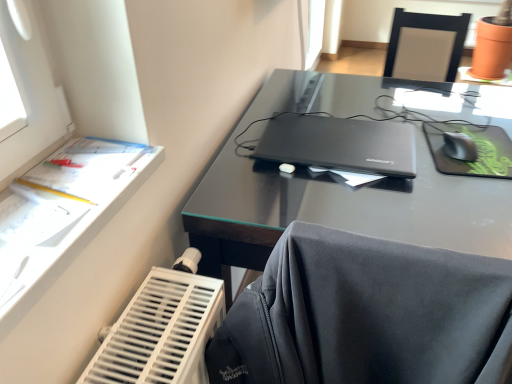
Describe the element at coordinates (342, 186) in the screenshot. I see `glossy black desk at center` at that location.

You are a GUI agent. You are given a task and a screenshot of the screen. Output one action in this format:
    pyautogui.click(x=<x>, y=<y>)
    Task: Click on the black matte mouse pad at right
    The height and width of the screenshot is (384, 512).
    Given the screenshot: What is the action you would take?
    pyautogui.click(x=476, y=147)

Where is `glossy black desk at center`? This screenshot has width=512, height=384. glossy black desk at center is located at coordinates (342, 186).

Considering the sizes of black matte mouse pad at right and white paper at left in the image, is black matte mouse pad at right wider or thinner than white paper at left?

black matte mouse pad at right is wider than white paper at left.

In terms of height, does black matte mouse pad at right look taller or shorter compared to white paper at left?

Clearly, black matte mouse pad at right is shorter compared to white paper at left.

Locate an element on the screen. tablet computer that is above the white paper at left (from the image's perspective) is located at coordinates (476, 147).

Which point is more forward, (451, 128) or (105, 215)?

The point (105, 215) is more forward.

In the image, is white paper at left positioned in front of or behind glossy black desk at center?

white paper at left is positioned closer to the viewer than glossy black desk at center.

Does white paper at left have a lesser width compared to glossy black desk at center?

Correct, the width of white paper at left is less than that of glossy black desk at center.

Considering the relative sizes of white paper at left and glossy black desk at center in the image provided, is white paper at left shorter than glossy black desk at center?

Correct, white paper at left is not as tall as glossy black desk at center.

Is matte black laptop at center in front of or behind black matte mouse pad at right in the image?

Visually, matte black laptop at center is located in front of black matte mouse pad at right.

Does matte black laptop at center appear on the left side of black matte mouse pad at right?

Yes, matte black laptop at center is to the left of black matte mouse pad at right.

From a real-world perspective, which is physically below, matte black laptop at center or black matte mouse pad at right?

From a 3D spatial view, black matte mouse pad at right is below.

Could you tell me if matte black laptop at center is turned towards black matte mouse pad at right?

No.

Is matte black laptop at center wider or thinner than white paper at left?

matte black laptop at center is wider than white paper at left.

From a real-world perspective, which is physically below, matte black laptop at center or white paper at left?

matte black laptop at center is physically lower.

The width and height of the screenshot is (512, 384). What are the coordinates of `laptop that is behind the white paper at left` in the screenshot? It's located at (340, 144).

Is matte black laptop at center next to white paper at left?

No, matte black laptop at center is not touching white paper at left.

From the image's perspective, is black plastic mouse at right located above or below black matte mouse pad at right?

From the image's perspective, black plastic mouse at right appears above black matte mouse pad at right.

Considering the sizes of objects black plastic mouse at right and black matte mouse pad at right in the image provided, who is shorter, black plastic mouse at right or black matte mouse pad at right?

With less height is black matte mouse pad at right.

How far apart are black plastic mouse at right and black matte mouse pad at right?

black plastic mouse at right is 4.98 centimeters from black matte mouse pad at right.

Is black plastic mouse at right positioned with its back to black matte mouse pad at right?

Correct, black plastic mouse at right is looking away from black matte mouse pad at right.

Is glossy black desk at center inside or outside of matte black laptop at center?

glossy black desk at center is not enclosed by matte black laptop at center.

You are a GUI agent. You are given a task and a screenshot of the screen. Output one action in this format:
    pyautogui.click(x=<x>, y=<y>)
    Task: Click on the desk located underneath the matte black laptop at center (from a real-world perspective)
    This screenshot has height=384, width=512.
    Given the screenshot: What is the action you would take?
    pyautogui.click(x=342, y=186)

Is glossy black desk at center wider than matte black laptop at center?

Indeed, glossy black desk at center has a greater width compared to matte black laptop at center.

Considering the sizes of objects glossy black desk at center and matte black laptop at center in the image provided, who is smaller, glossy black desk at center or matte black laptop at center?

Smaller between the two is matte black laptop at center.

How far apart are glossy black desk at center and white paper at left?

A distance of 17.50 inches exists between glossy black desk at center and white paper at left.

Is white paper at left at the back of glossy black desk at center?

That's not correct — glossy black desk at center is not looking away from white paper at left.

From a real-world perspective, is glossy black desk at center located higher than white paper at left?

No.

Find the location of a particular element. The height and width of the screenshot is (384, 512). writing desk located on the left of black matte mouse pad at right is located at coordinates (63, 216).

Find the location of a particular element. The height and width of the screenshot is (384, 512). desk that appears behind the white paper at left is located at coordinates (342, 186).

When comparing their distances from matte black laptop at center, does black plastic mouse at right or white paper at left seem further?

white paper at left is positioned further to the anchor matte black laptop at center.

Estimate the real-world distances between objects in this image. Which object is closer to black matte mouse pad at right, white paper at left or matte black laptop at center?

Among the two, matte black laptop at center is located nearer to black matte mouse pad at right.

Looking at the image, which one is located closer to matte black laptop at center, glossy black desk at center or black matte mouse pad at right?

glossy black desk at center is positioned closer to the anchor matte black laptop at center.

Estimate the real-world distances between objects in this image. Which object is further from matte black laptop at center, glossy black desk at center or black plastic mouse at right?

Based on the image, black plastic mouse at right appears to be further to matte black laptop at center.

When comparing their distances from matte black laptop at center, does black plastic mouse at right or black matte mouse pad at right seem further?

The object further to matte black laptop at center is black plastic mouse at right.

When comparing their distances from black matte mouse pad at right, does matte black laptop at center or glossy black desk at center seem further?

glossy black desk at center lies further to black matte mouse pad at right than the other object.

Considering their positions, is black matte mouse pad at right positioned further to glossy black desk at center than matte black laptop at center?

black matte mouse pad at right is positioned further to the anchor glossy black desk at center.

When comparing their distances from white paper at left, does glossy black desk at center or black matte mouse pad at right seem closer?

Based on the image, glossy black desk at center appears to be nearer to white paper at left.

The height and width of the screenshot is (384, 512). What are the coordinates of `desk between matte black laptop at center and black matte mouse pad at right` in the screenshot? It's located at (342, 186).

The height and width of the screenshot is (384, 512). Identify the location of tablet computer between glossy black desk at center and black plastic mouse at right in the front-back direction. (476, 147).

Identify the location of laptop between white paper at left and black matte mouse pad at right in the horizontal direction. coord(340,144).

This screenshot has width=512, height=384. I want to click on desk located between white paper at left and black matte mouse pad at right in the left-right direction, so click(342, 186).